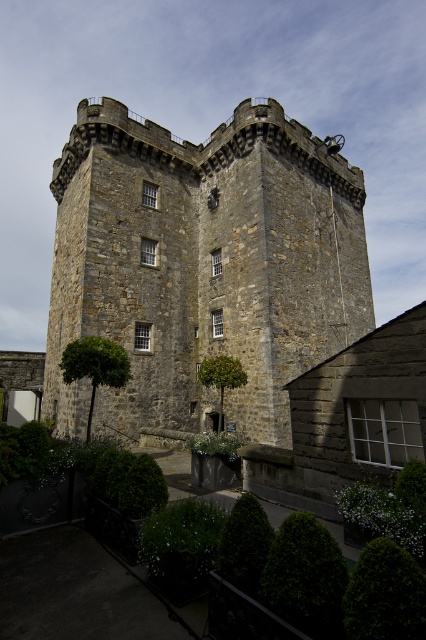
You are a visitor standing in the garden area. You want to take a photo of the rustic stone castle at center without the green leafy tree at lower left appearing in the background. Is it possible to position yourself in such a way that the castle is visible but the tree is not?

The rustic stone castle at center is positioned over the green leafy tree at lower left, meaning the castle is closer to you than the tree. Since the castle is in front of the tree, you can position yourself so that the castle blocks the view of the tree, allowing you to take a photo of the castle without the tree in the background.

You are a visitor standing at the base of the historic stone tower. You notice two green leafy trees in the garden area. Which tree, the green leafy tree at lower left or the green leafy tree at center, is larger in size?

The green leafy tree at lower left is bigger than the green leafy tree at center, so the one at the lower left is larger in size.